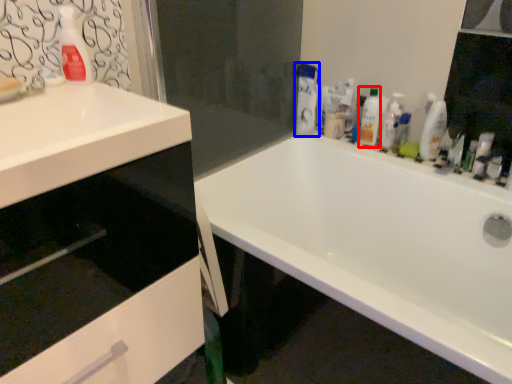
Question: Which object is further to the camera taking this photo, cleaning product (highlighted by a red box) or cleaning product (highlighted by a blue box)?

Choices:
 (A) cleaning product
 (B) cleaning product

Answer: (B)